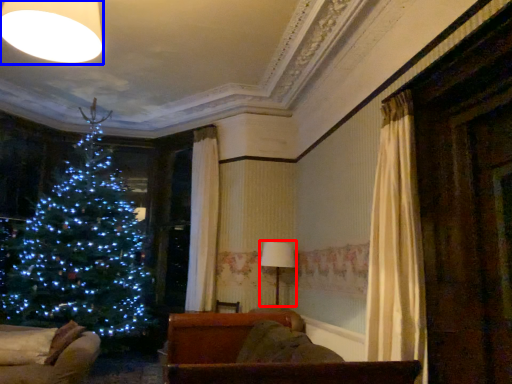
Question: Which object appears closest to the camera in this image, lamp (highlighted by a red box) or lighting (highlighted by a blue box)?

Choices:
 (A) lamp
 (B) lighting

Answer: (B)